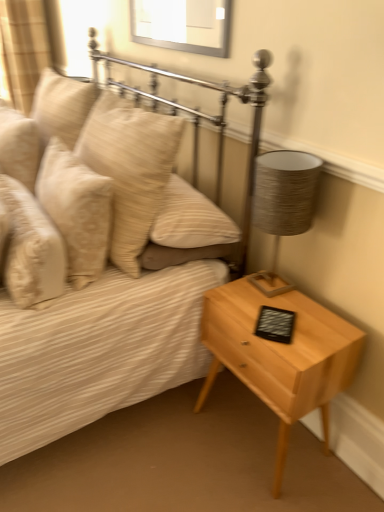
Question: Is beige textured pillow at left, which is the fourth pillow in right-to-left order, smaller than beige textured pillow at left, the second pillow in the left-to-right sequence?

Choices:
 (A) no
 (B) yes

Answer: (B)

Question: Is beige textured pillow at left, acting as the 1th pillow starting from the left, to the right of beige textured pillow at left, the second pillow in the left-to-right sequence, from the viewer's perspective?

Choices:
 (A) no
 (B) yes

Answer: (A)

Question: From the image's perspective, is beige textured pillow at left, acting as the 1th pillow starting from the left, under beige textured pillow at left, which is the 3th pillow in right-to-left order?

Choices:
 (A) yes
 (B) no

Answer: (B)

Question: Is the position of beige textured pillow at left, which is the fourth pillow in right-to-left order, more distant than that of beige textured pillow at left, which is the 3th pillow in right-to-left order?

Choices:
 (A) no
 (B) yes

Answer: (B)

Question: From a real-world perspective, is textured gray lampshade at right above or below beige fabric curtain at upper left?

Choices:
 (A) below
 (B) above

Answer: (A)

Question: Which is correct: textured gray lampshade at right is inside beige fabric curtain at upper left, or outside of it?

Choices:
 (A) inside
 (B) outside

Answer: (B)

Question: From the image's perspective, is textured gray lampshade at right positioned above or below beige fabric curtain at upper left?

Choices:
 (A) below
 (B) above

Answer: (A)

Question: Is textured gray lampshade at right taller or shorter than beige fabric curtain at upper left?

Choices:
 (A) short
 (B) tall

Answer: (A)

Question: From the image's perspective, is beige textured pillow at upper left, the first pillow in the right-to-left sequence, above or below light wood/texture nightstand at lower right?

Choices:
 (A) above
 (B) below

Answer: (A)

Question: Considering the positions of beige textured pillow at upper left, arranged as the fourth pillow when viewed from the left, and light wood/texture nightstand at lower right in the image, is beige textured pillow at upper left, arranged as the fourth pillow when viewed from the left, wider or thinner than light wood/texture nightstand at lower right?

Choices:
 (A) thin
 (B) wide

Answer: (B)

Question: Would you say beige textured pillow at upper left, arranged as the fourth pillow when viewed from the left, is to the left or to the right of light wood/texture nightstand at lower right in the picture?

Choices:
 (A) left
 (B) right

Answer: (A)

Question: Does point coord(122,218) appear closer or farther from the camera than point coord(236,371)?

Choices:
 (A) farther
 (B) closer

Answer: (B)

Question: In terms of height, does textured gray lampshade at right look taller or shorter compared to matte beige bed at center?

Choices:
 (A) tall
 (B) short

Answer: (B)

Question: Is textured gray lampshade at right in front of or behind matte beige bed at center in the image?

Choices:
 (A) behind
 (B) front

Answer: (A)